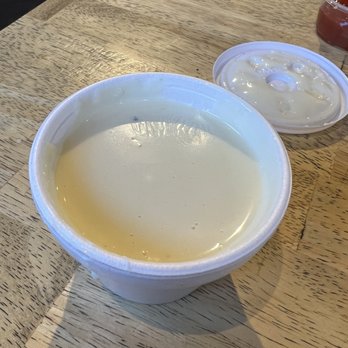
Identify the location of table top. (301, 292).